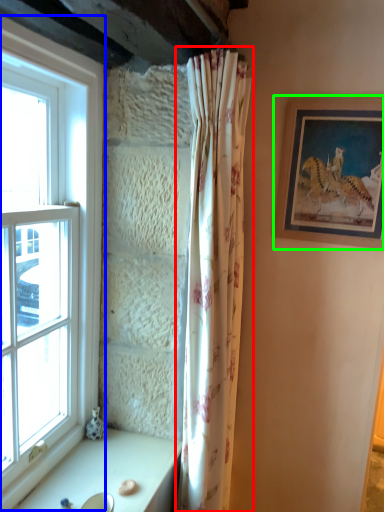
Question: Based on their relative distances, which object is farther from curtain (highlighted by a red box)? Choose from window (highlighted by a blue box) and picture frame (highlighted by a green box).

Choices:
 (A) window
 (B) picture frame

Answer: (A)